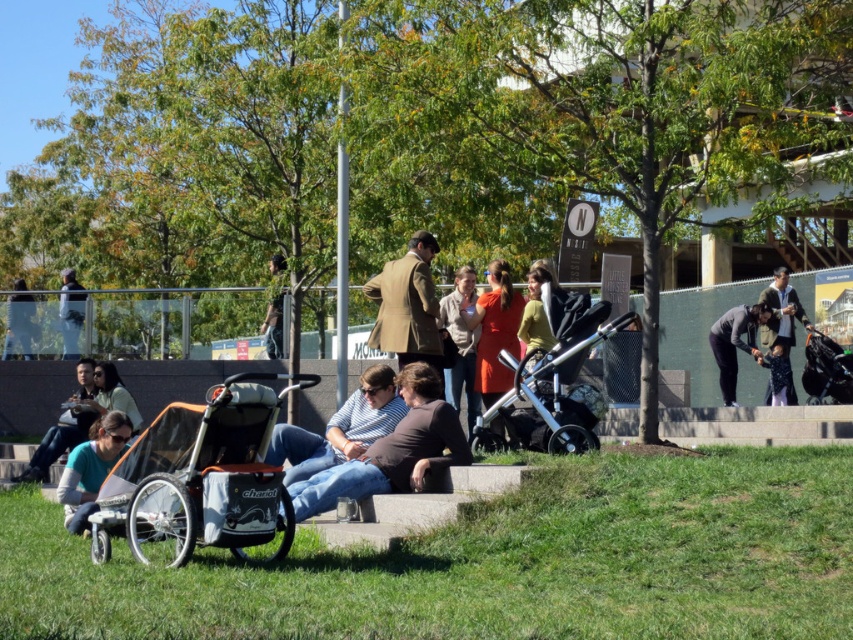
You are a parent carrying a toddler and need to place a stroller in the safest spot in the image. The safest spot requires the stroller to be placed on a surface that is higher than the toddler. Based on the scene, can the silver metallic stroller at center be placed on the green grass at lower left to meet this requirement?

The green grass at lower left is not as tall as the silver metallic stroller at center, so the stroller can be placed on the green grass at lower left because the stroller is taller than the grass, meeting the requirement of being higher than the toddler.

You are a photographer trying to capture a candid shot of both the matte black jacket at lower left and the dark gray jacket at upper right in the same frame. Based on their positions, which jacket will appear closer to the bottom of your photo?

The matte black jacket at lower left will appear closer to the bottom of the photo because it is positioned below the dark gray jacket at upper right.